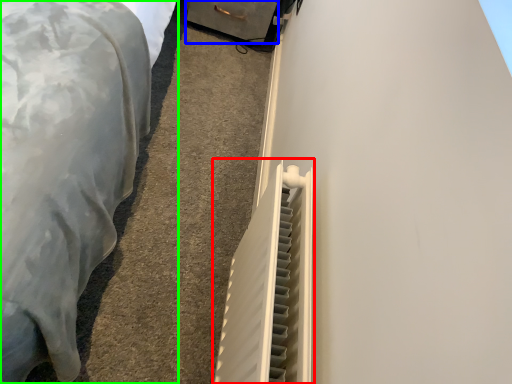
Question: Considering the real-world distances, which object is farthest from radiator (highlighted by a red box)? drawer (highlighted by a blue box) or furniture (highlighted by a green box)?

Choices:
 (A) drawer
 (B) furniture

Answer: (A)